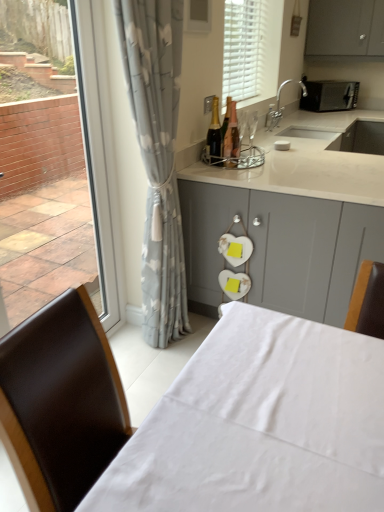
Question: Do you think gray floral curtain at left is within white matte blinds at upper center, or outside of it?

Choices:
 (A) outside
 (B) inside

Answer: (A)

Question: Considering the positions of gray floral curtain at left and white matte blinds at upper center in the image, is gray floral curtain at left wider or thinner than white matte blinds at upper center?

Choices:
 (A) wide
 (B) thin

Answer: (A)

Question: Considering the real-world distances, which object is closest to the silver metallic faucet at upper right?

Choices:
 (A) black matte microwave at upper right
 (B) shiny gold bottle at center, the 2th bottle when ordered from left to right
 (C) transparent glass window at left
 (D) white fabric table at lower center
 (E) gray floral curtain at left

Answer: (A)

Question: Which object is positioned farthest from the gray floral curtain at left?

Choices:
 (A) matte gray cabinets at center
 (B) shiny gold bottle at center, the 2th bottle when ordered from left to right
 (C) black matte microwave at upper right
 (D) white matte blinds at upper center
 (E) shiny gold champagne bottle at center, which ranks as the second bottle in right-to-left order

Answer: (C)